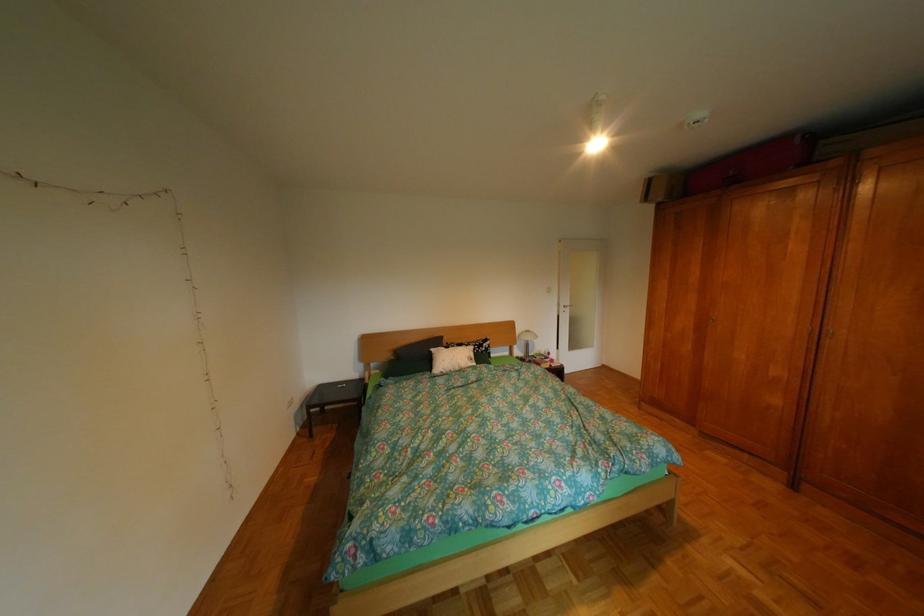
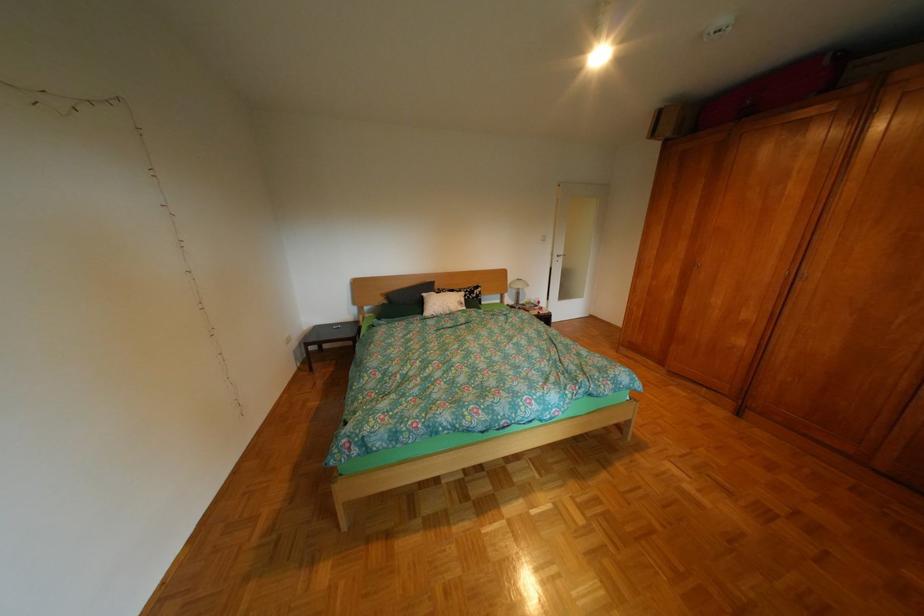
In the second image, find the point that corresponds to [529,344] in the first image.

(521, 292)